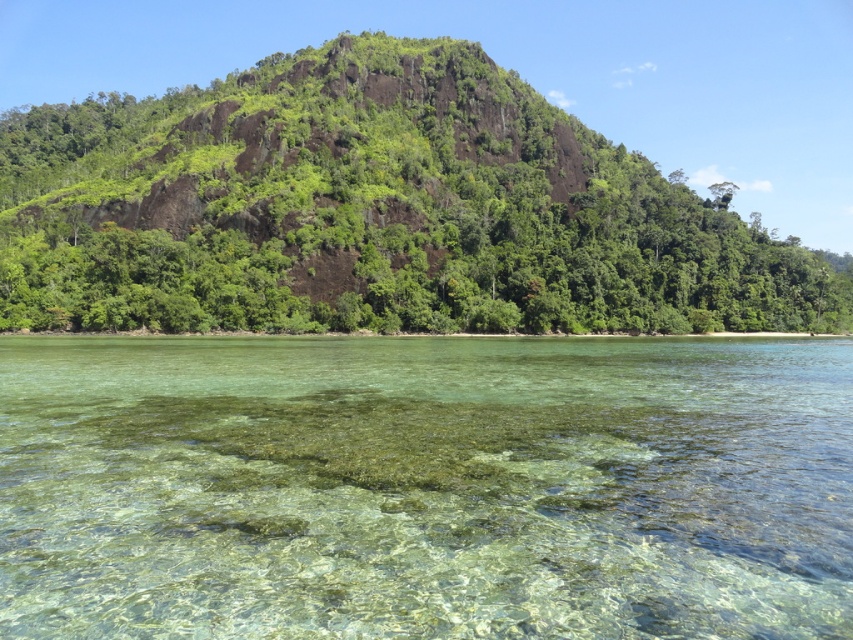
How far apart are clear glassy water at center and green mossy rock at center?

A: The distance of clear glassy water at center from green mossy rock at center is 170.27 meters.

Can you confirm if clear glassy water at center is taller than green mossy rock at center?

Incorrect, clear glassy water at center's height is not larger of green mossy rock at center's.

Where is `clear glassy water at center`? clear glassy water at center is located at coordinates coord(425,486).

I want to click on clear glassy water at center, so click(x=425, y=486).